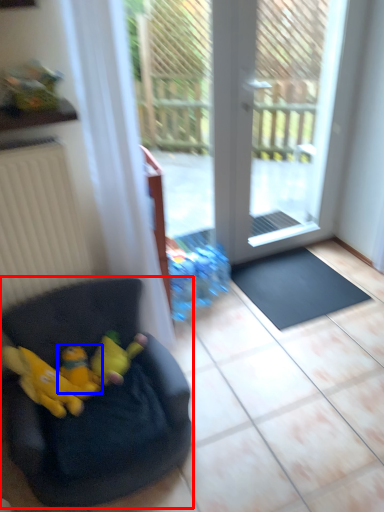
Question: Among these objects, which one is nearest to the camera, chair (highlighted by a red box) or toy (highlighted by a blue box)?

Choices:
 (A) chair
 (B) toy

Answer: (A)